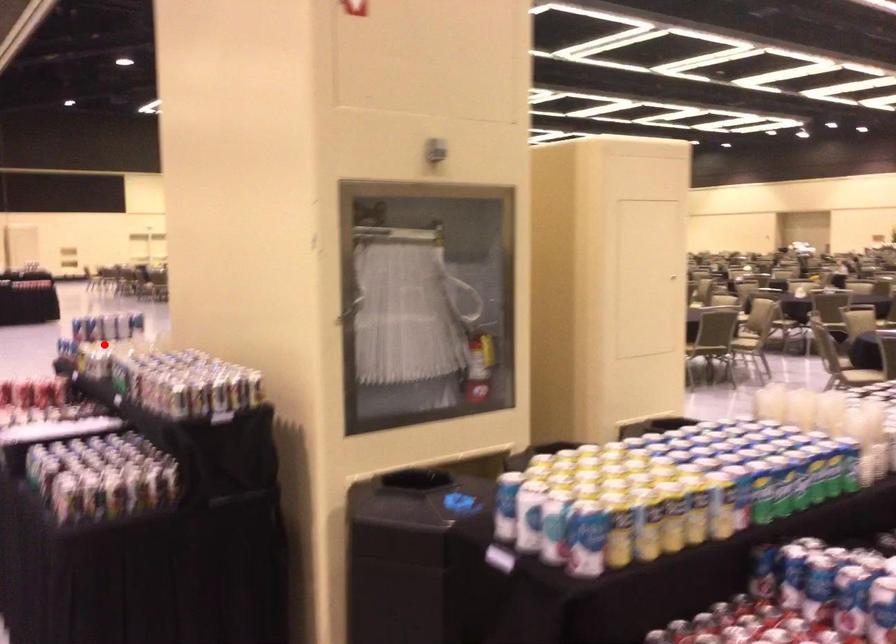
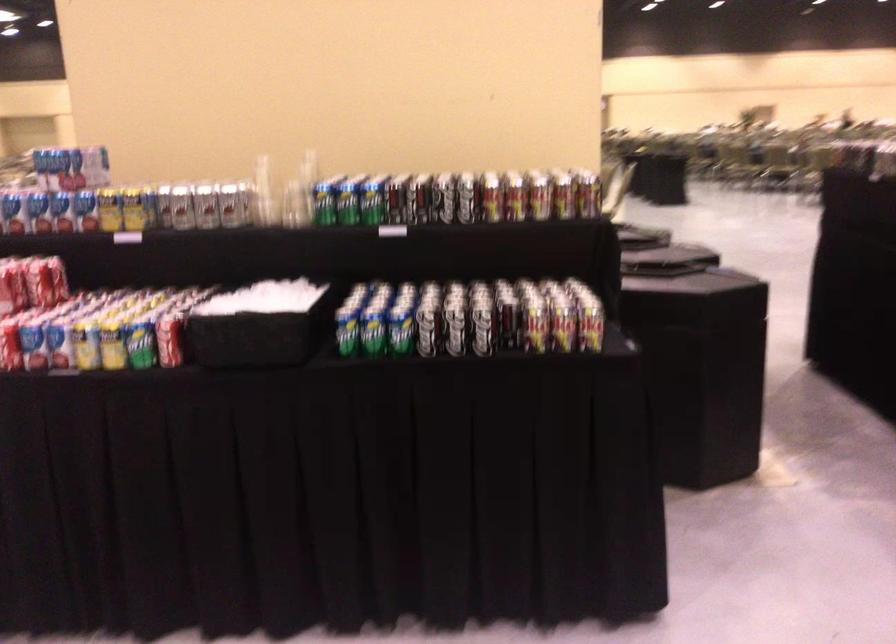
Question: I am providing you with two images of the same scene from different viewpoints. In image1, a red point is highlighted. Considering the same 3D point in image2, which of the following is correct?

Choices:
 (A) It is closer
 (B) It is farther

Answer: (A)